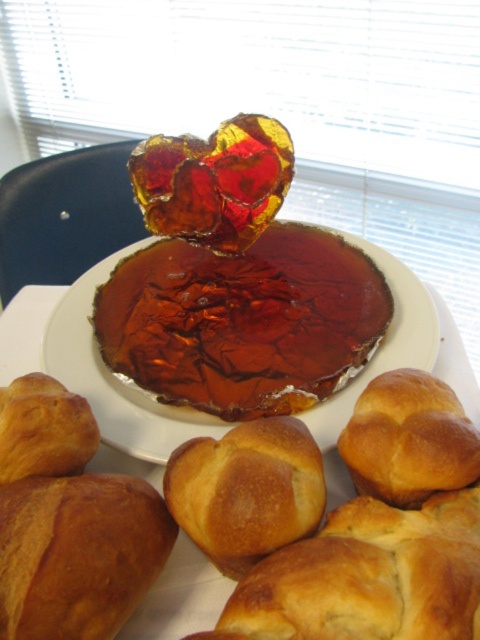
From the picture: Which is above, shiny brown cake at center or golden brown crusty croissant at lower left?

shiny brown cake at center is higher up.

Which is in front, point (297, 301) or point (82, 532)?

Positioned in front is point (82, 532).

Who is more forward, (168, 403) or (99, 577)?

Point (99, 577)

Locate an element on the screen. Image resolution: width=480 pixels, height=640 pixels. shiny brown cake at center is located at coordinates (242, 321).

Does golden brown bread at center appear on the right side of golden brown croissant at lower left?

Indeed, golden brown bread at center is positioned on the right side of golden brown croissant at lower left.

What do you see at coordinates (247, 490) in the screenshot? I see `golden brown bread at center` at bounding box center [247, 490].

Locate an element on the screen. This screenshot has width=480, height=640. golden brown bread at center is located at coordinates (247, 490).

Who is positioned more to the left, shiny brown cake at center or golden brown doughnut at lower right?

shiny brown cake at center is more to the left.

Is shiny brown cake at center to the right of golden brown doughnut at lower right from the viewer's perspective?

In fact, shiny brown cake at center is to the left of golden brown doughnut at lower right.

This screenshot has width=480, height=640. What are the coordinates of `shiny brown cake at center` in the screenshot? It's located at (242, 321).